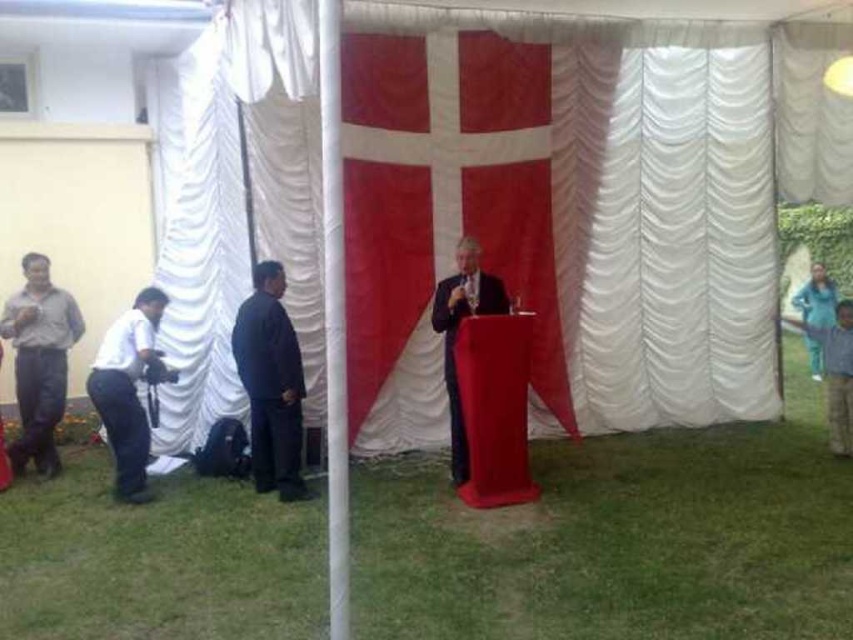
How distant is white satin curtain at center from blue fabric at right?

A distance of 3.05 meters exists between white satin curtain at center and blue fabric at right.

Who is taller, white satin curtain at center or blue fabric at right?

Standing taller between the two is white satin curtain at center.

Who is more distant from viewer, (596, 291) or (816, 308)?

The point (816, 308) is behind.

This screenshot has width=853, height=640. I want to click on white satin curtain at center, so click(x=682, y=244).

Who is higher up, white matte camera at lower left or blue fabric at right?

Positioned higher is blue fabric at right.

Is point (115, 499) more distant than point (813, 330)?

No, it is in front of (813, 330).

Find the location of `white matte camera at lower left`. white matte camera at lower left is located at coordinates (128, 388).

Find the location of a particular element. Image resolution: width=853 pixels, height=640 pixels. white matte camera at lower left is located at coordinates (128, 388).

Is point (126, 406) positioned before point (462, 273)?

Yes, it is in front of point (462, 273).

At what (x,y) coordinates should I click in order to perform the action: click on white matte camera at lower left. Please return your answer as a coordinate pair (x, y). Looking at the image, I should click on (128, 388).